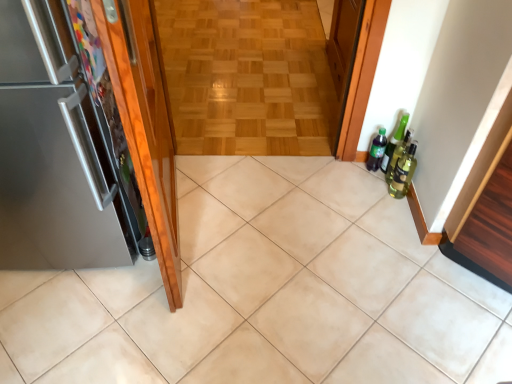
At what (x,y) coordinates should I click in order to perform the action: click on free area in between shiny wood door at left, the second door from the left, and wooden cabinet at right. Please return your answer as a coordinate pair (x, y). Looking at the image, I should click on click(x=311, y=254).